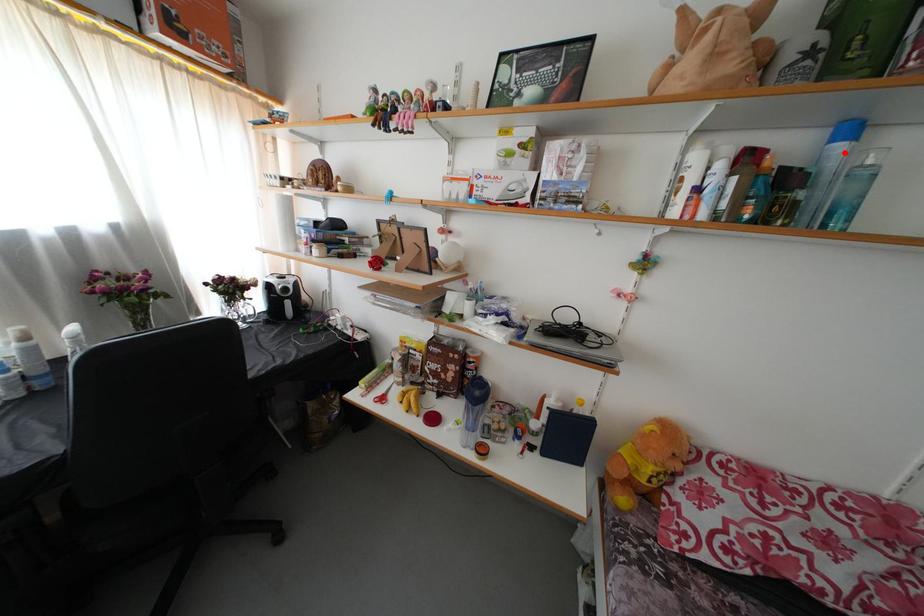
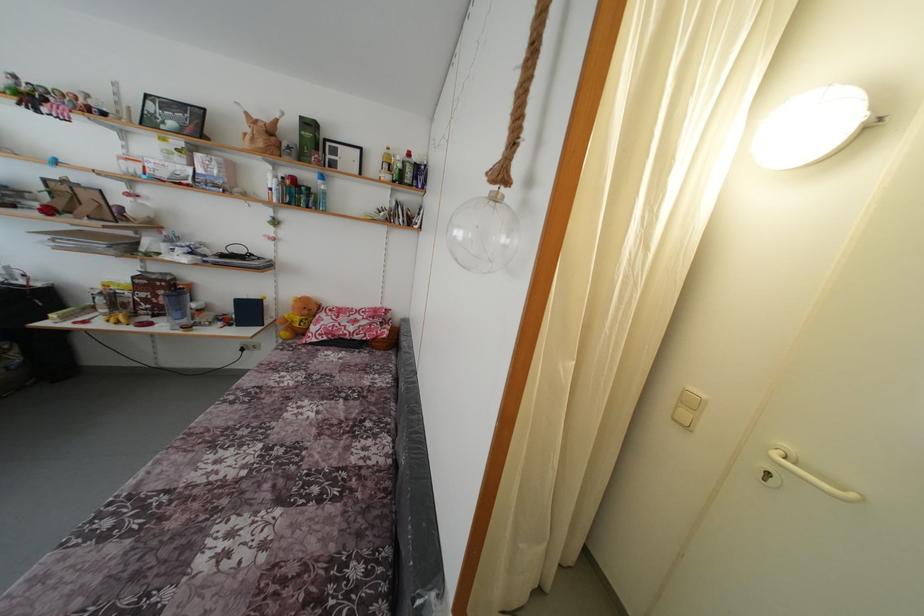
Where in the second image is the point corresponding to the highlighted location from the first image?

(324, 188)